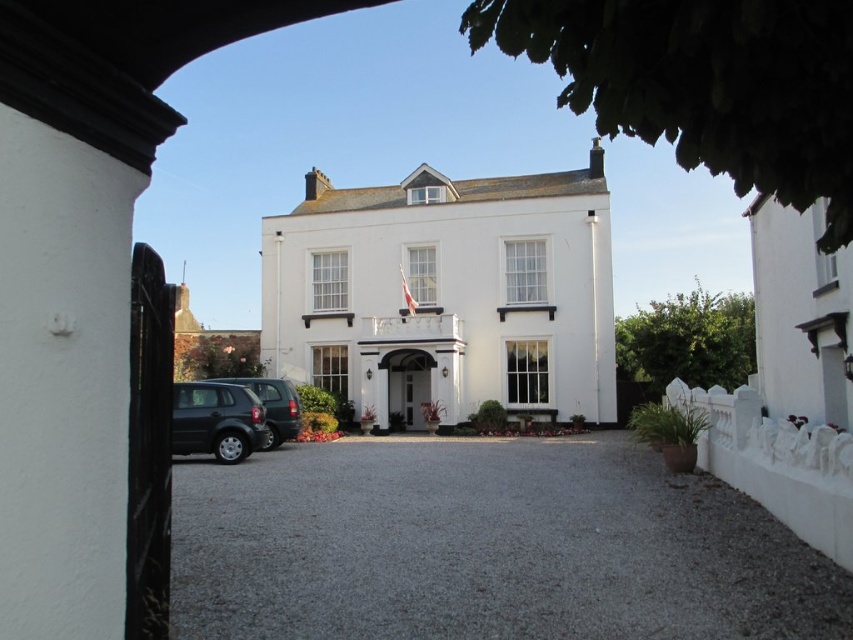
Question: Does satin black car at lower left appear under matte dark green suv at lower left?

Choices:
 (A) no
 (B) yes

Answer: (B)

Question: Which point is closer to the camera?

Choices:
 (A) gray gravel driveway at center
 (B) matte dark green suv at lower left

Answer: (A)

Question: Which point is farther to the camera?

Choices:
 (A) satin black car at lower left
 (B) matte dark green suv at lower left

Answer: (B)

Question: Is satin black car at lower left further to the viewer compared to matte dark green suv at lower left?

Choices:
 (A) no
 (B) yes

Answer: (A)

Question: Which point is closer to the camera?

Choices:
 (A) (280, 620)
 (B) (245, 445)
 (C) (250, 380)

Answer: (A)

Question: Can you confirm if gray gravel driveway at center is positioned above satin black car at lower left?

Choices:
 (A) yes
 (B) no

Answer: (B)